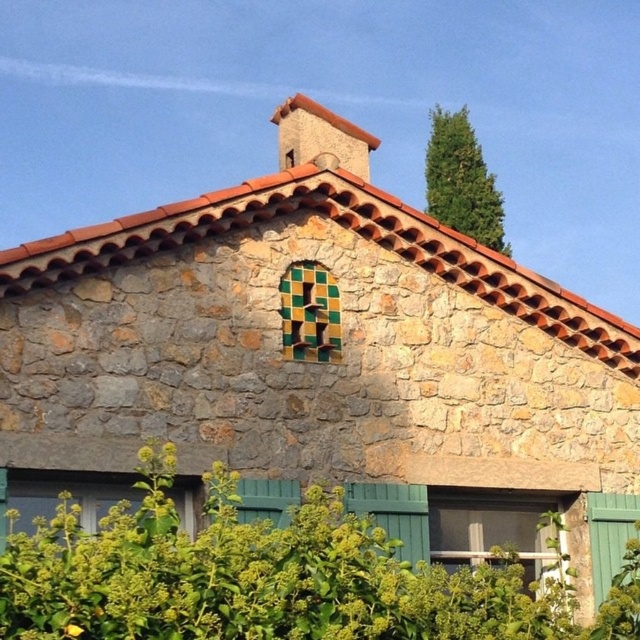
Is clear glass window at lower center to the left of matte white window at lower left from the viewer's perspective?

In fact, clear glass window at lower center is to the right of matte white window at lower left.

Can you confirm if clear glass window at lower center is positioned below matte white window at lower left?

Correct, clear glass window at lower center is located below matte white window at lower left.

Does point (470, 524) come farther from viewer compared to point (76, 486)?

Yes.

The image size is (640, 640). I want to click on clear glass window at lower center, so click(x=490, y=529).

What do you see at coordinates (58, 499) in the screenshot?
I see `matte white window at lower left` at bounding box center [58, 499].

Which is more to the right, matte white window at lower left or green mosaic tiles at center?

green mosaic tiles at center

Who is more distant from viewer, (193, 525) or (307, 292)?

Positioned behind is point (307, 292).

Image resolution: width=640 pixels, height=640 pixels. I want to click on matte white window at lower left, so (58, 499).

Between green leafy tree at upper right and matte white window at lower left, which one appears on the right side from the viewer's perspective?

From the viewer's perspective, green leafy tree at upper right appears more on the right side.

Is green leafy tree at upper right shorter than matte white window at lower left?

No, green leafy tree at upper right is not shorter than matte white window at lower left.

Where is `green leafy tree at upper right`? This screenshot has width=640, height=640. green leafy tree at upper right is located at coordinates (461, 180).

The image size is (640, 640). Find the location of `green leafy tree at upper right`. green leafy tree at upper right is located at coordinates (461, 180).